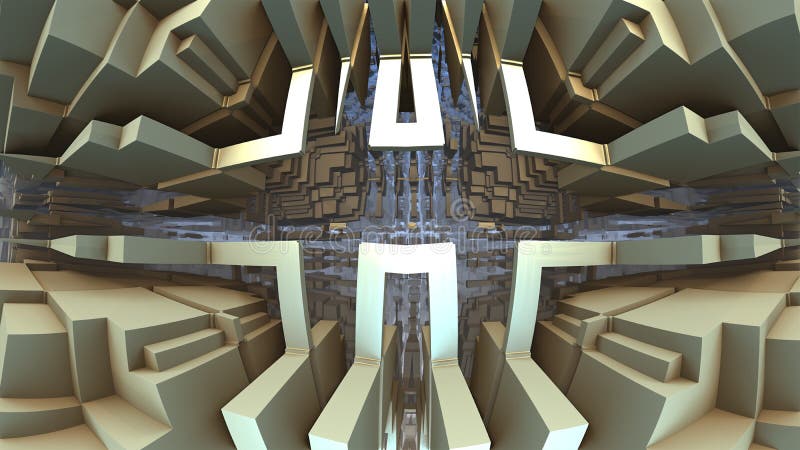
Find the location of `bright reflection from light source`. bright reflection from light source is located at coordinates (393, 261), (422, 121), (294, 134), (528, 125).